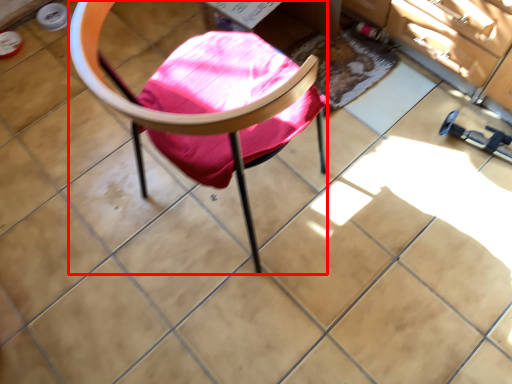
Question: From the image's perspective, considering the relative positions of chair (annotated by the red box) and mat in the image provided, where is chair (annotated by the red box) located with respect to the staircase?

Choices:
 (A) above
 (B) below

Answer: (B)